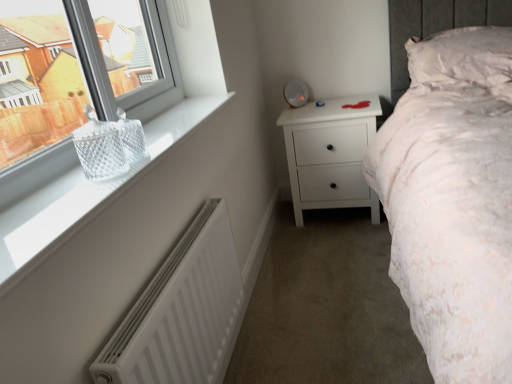
Question: Does clear glass basket at left, which appears as the 1th window when ordered from the bottom, have a lesser width compared to white textured pillow at upper right?

Choices:
 (A) no
 (B) yes

Answer: (B)

Question: Can you confirm if clear glass basket at left, which is the second window from top to bottom, is shorter than white textured pillow at upper right?

Choices:
 (A) yes
 (B) no

Answer: (A)

Question: From a real-world perspective, is clear glass basket at left, which is the second window from top to bottom, over white textured pillow at upper right?

Choices:
 (A) yes
 (B) no

Answer: (A)

Question: Is clear glass basket at left, which is the second window from top to bottom, bigger than white textured pillow at upper right?

Choices:
 (A) no
 (B) yes

Answer: (A)

Question: Does clear glass basket at left, which is the second window from top to bottom, come behind white textured pillow at upper right?

Choices:
 (A) no
 (B) yes

Answer: (A)

Question: From a real-world perspective, is clear glass basket at upper left, which is the second window in bottom-to-top order, above or below clear glass basket at left, which appears as the 1th window when ordered from the bottom?

Choices:
 (A) above
 (B) below

Answer: (A)

Question: Would you say clear glass basket at upper left, which is the second window in bottom-to-top order, is to the left or to the right of clear glass basket at left, which is the second window from top to bottom, in the picture?

Choices:
 (A) left
 (B) right

Answer: (A)

Question: From the image's perspective, is clear glass basket at upper left, which is the second window in bottom-to-top order, above or below clear glass basket at left, which is the second window from top to bottom?

Choices:
 (A) below
 (B) above

Answer: (B)

Question: In terms of width, does clear glass basket at upper left, the 1th window from the top, look wider or thinner when compared to clear glass basket at left, which is the second window from top to bottom?

Choices:
 (A) thin
 (B) wide

Answer: (A)

Question: Does point (162, 352) appear closer or farther from the camera than point (206, 86)?

Choices:
 (A) farther
 (B) closer

Answer: (B)

Question: Is white matte radiator at lower left situated inside clear glass basket at left, which is the second window from top to bottom, or outside?

Choices:
 (A) inside
 (B) outside

Answer: (B)

Question: From the image's perspective, relative to clear glass basket at left, which is the second window from top to bottom, is white matte radiator at lower left above or below?

Choices:
 (A) below
 (B) above

Answer: (A)

Question: Is white matte radiator at lower left to the left or to the right of clear glass basket at left, which appears as the 1th window when ordered from the bottom, in the image?

Choices:
 (A) left
 (B) right

Answer: (B)

Question: From their relative heights in the image, would you say clear glass basket at left, which appears as the 1th window when ordered from the bottom, is taller or shorter than white matte chest of drawers at center?

Choices:
 (A) short
 (B) tall

Answer: (A)

Question: Based on their sizes in the image, would you say clear glass basket at left, which appears as the 1th window when ordered from the bottom, is bigger or smaller than white matte chest of drawers at center?

Choices:
 (A) big
 (B) small

Answer: (B)